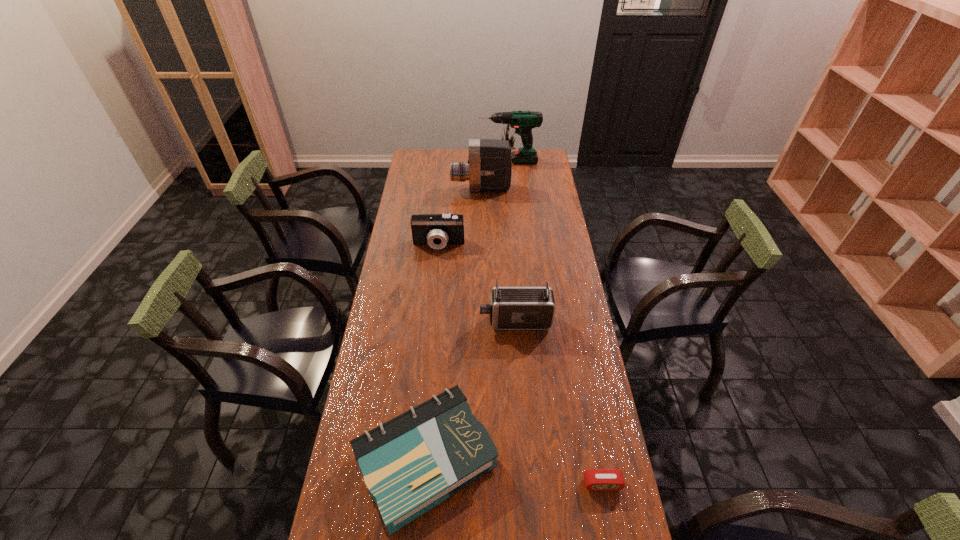
Identify the location of vacant region located 0.260m on the handle side of the farthest object. (430, 161).

This screenshot has height=540, width=960. I want to click on free space located on the handle side of the farthest object, so click(436, 161).

I want to click on free space located 0.220m at the front of the farthest camcorder, highlighting the lens, so click(408, 188).

Where is `vacant space located 0.050m at the front of the farthest camcorder, highlighting the lens`? The image size is (960, 540). vacant space located 0.050m at the front of the farthest camcorder, highlighting the lens is located at coordinates (442, 188).

Identify the location of vacant point located at the front of the farthest camcorder, highlighting the lens. Image resolution: width=960 pixels, height=540 pixels. (421, 188).

Where is `blank space located 0.220m at the lens of the second shortest camcorder`? blank space located 0.220m at the lens of the second shortest camcorder is located at coordinates (420, 321).

The height and width of the screenshot is (540, 960). In order to click on free point located 0.330m at the lens of the second shortest camcorder in this screenshot , I will do `click(389, 321)`.

Where is `vacant area located at the lens of the second shortest camcorder`? This screenshot has width=960, height=540. vacant area located at the lens of the second shortest camcorder is located at coordinates coord(417,321).

Where is `free space located 0.280m on the lens of the shortest camcorder`? This screenshot has height=540, width=960. free space located 0.280m on the lens of the shortest camcorder is located at coordinates (433, 301).

Identify the location of vacant space located 0.280m on the right of the second shortest object. (596, 460).